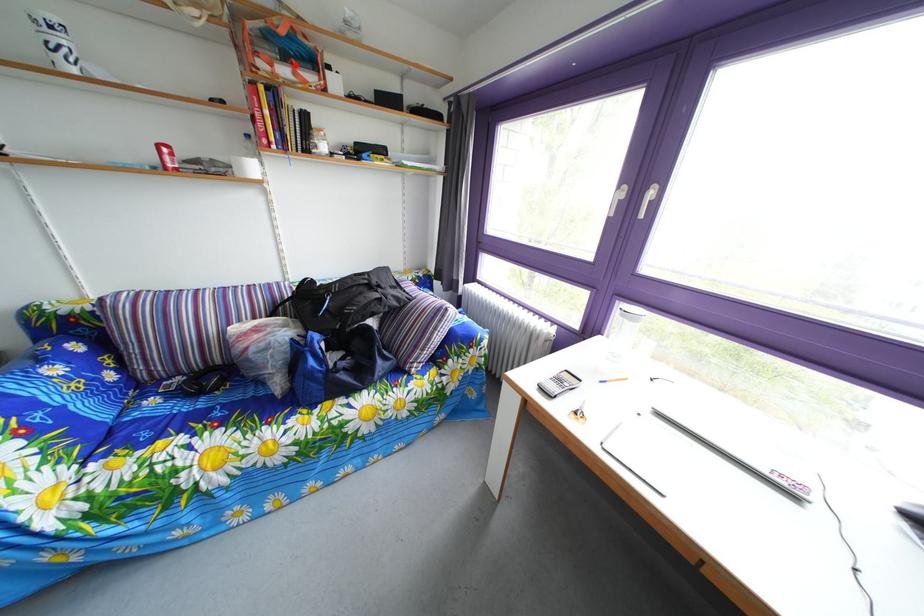
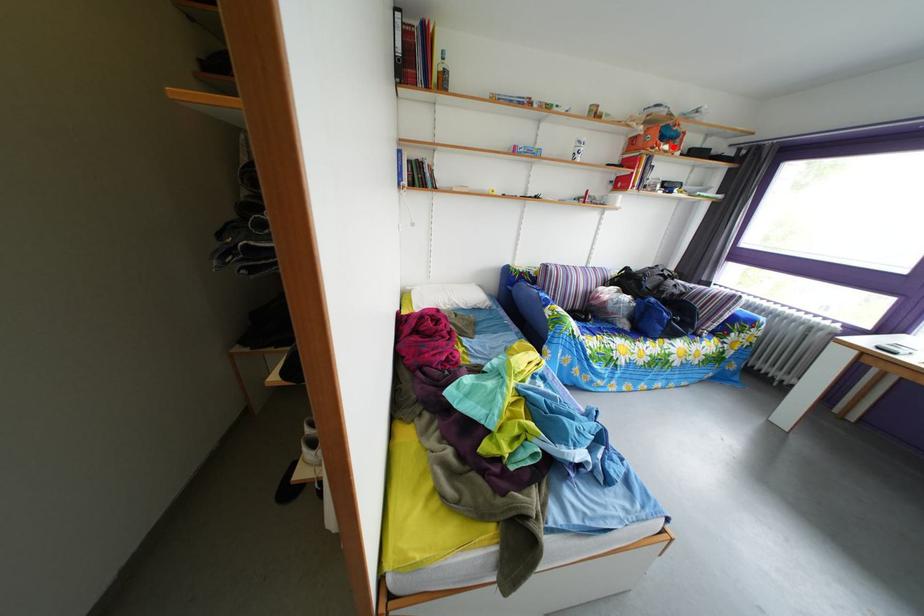
I am providing you with two images of the same scene from different viewpoints. A red point is marked on the first image and another point is marked on the second image. Is the marked point in image1 the same physical position as the marked point in image2?

Yes